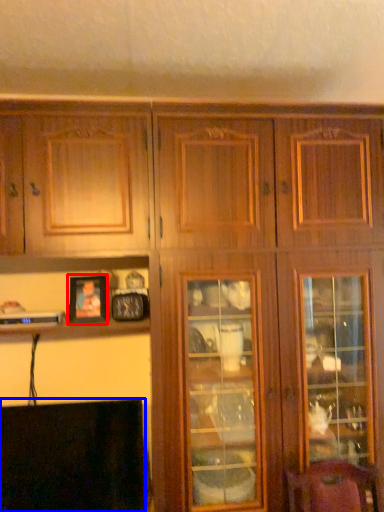
Question: Among these objects, which one is farthest to the camera, picture frame (highlighted by a red box) or fireplace (highlighted by a blue box)?

Choices:
 (A) picture frame
 (B) fireplace

Answer: (A)